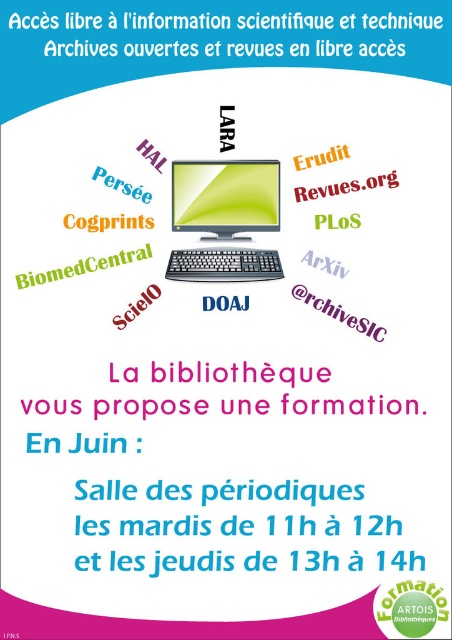
From the picture: Between white paper at upper center and black plastic keyboard at center, which one has less height?

With less height is black plastic keyboard at center.

Between point (268, 26) and point (221, 276), which one is positioned in front?

Point (221, 276)

I want to click on white paper at upper center, so click(175, 20).

Between black plastic keyboard at center and green matte biomedcentral at center, which one is positioned higher?

black plastic keyboard at center is above.

Is black plastic keyboard at center taller than green matte biomedcentral at center?

No.

Does point (238, 257) lie in front of point (47, 269)?

No, it is not.

You are a GUI agent. You are given a task and a screenshot of the screen. Output one action in this format:
    pyautogui.click(x=<x>, y=<y>)
    Task: Click on the black plastic keyboard at center
    The height and width of the screenshot is (640, 452).
    Given the screenshot: What is the action you would take?
    pyautogui.click(x=224, y=264)

Does matte black monitor at center appear on the left side of black plastic keyboard at center?

In fact, matte black monitor at center is to the right of black plastic keyboard at center.

Can you confirm if matte black monitor at center is taller than black plastic keyboard at center?

Yes, matte black monitor at center is taller than black plastic keyboard at center.

At what (x,y) coordinates should I click in order to perform the action: click on matte black monitor at center. Please return your answer as a coordinate pair (x, y). Looking at the image, I should click on (226, 196).

What are the coordinates of `matte black monitor at center` in the screenshot? It's located at (226, 196).